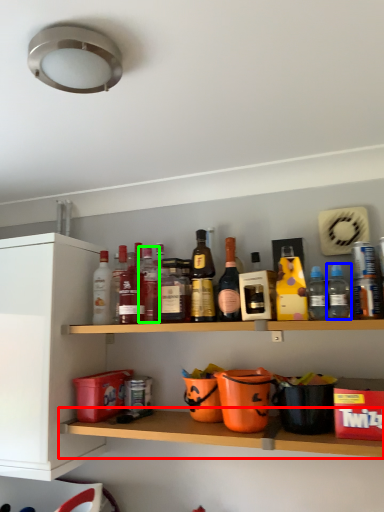
Question: Estimate the real-world distances between objects in this image. Which object is farther from shelf (highlighted by a red box), bottle (highlighted by a blue box) or bottle (highlighted by a green box)?

Choices:
 (A) bottle
 (B) bottle

Answer: (A)